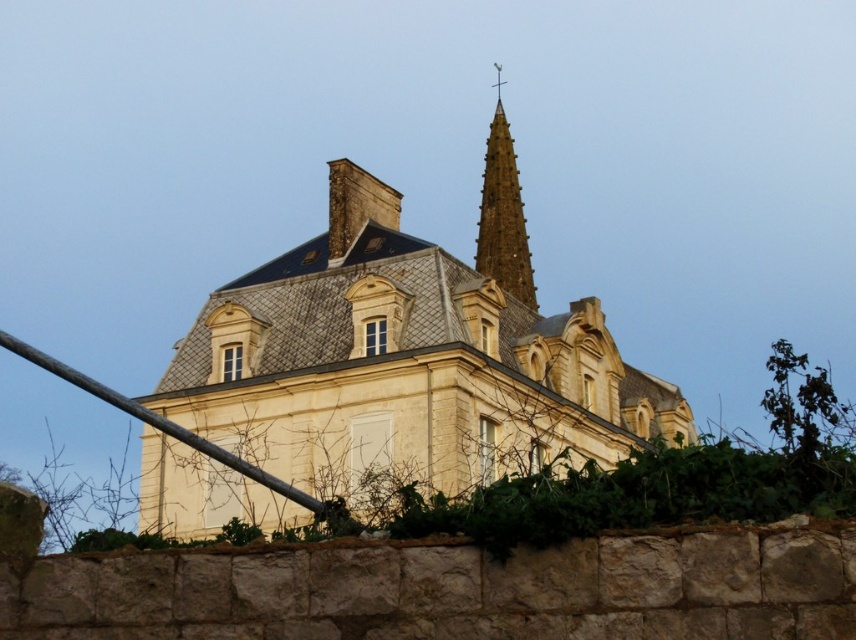
You are an architect assessing the historic building. You need to determine if the smooth brown spire at upper center can be replaced with a decorative element of the same size as the metallic pole at lower left. Based on their current spatial occupation, is this feasible?

The smooth brown spire at upper center occupies less space than the metallic pole at lower left. Therefore, replacing the spire with a decorative element the same size as the metallic pole at lower left would require more space, making it infeasible without adjustments.

You are a photographer standing at the front of the white stone church at center and the metallic pole at lower left. You want to capture a photo that includes both objects in the frame. Which object should you position closer to the camera to ensure both are fully visible?

The white stone church at center is much taller than the metallic pole at lower left. To ensure both are fully visible in the photo, position the metallic pole at lower left closer to the camera so its smaller size balances with the church in the background.

You are standing in front of the historic building and want to take a photo that includes both the white stone church at center and the smooth brown spire at upper center. Which object should you position closer to the camera to ensure both are in focus?

To ensure both the white stone church at center and the smooth brown spire at upper center are in focus, position the white stone church at center closer to the camera since it is in front of the smooth brown spire at upper center.